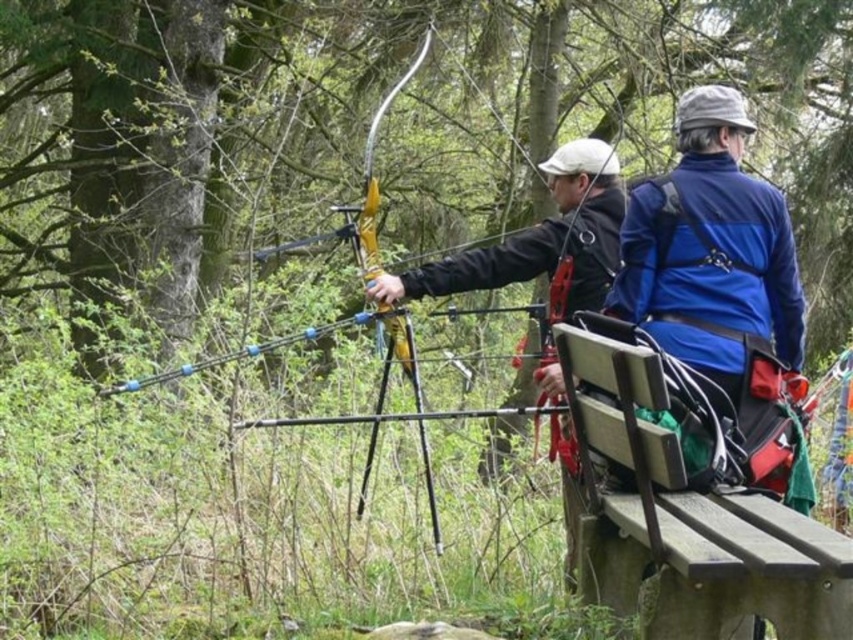
You are an archer standing at the edge of the woods, preparing to shoot an arrow. You notice a wooden park bench at center and a matte black jacket at center in your line of sight. Which object is closer to your position?

The wooden park bench at center is 1.52 meters away from matte black jacket at center. Since the question asks which is closer to your position, but the distance between them is provided, we need to clarify the exact positions. However, based on the given information, the bench and jacket are 1.52 meters apart. Without knowing your exact location relative to both, it is impossible to determine which is closer. The answer should state that the distance between them is known, but your position isnegative. 1.

You are an archer standing at point (593, 273) and want to shoot an arrow towards point (671, 627). Considering the archery scene described, will your arrow pass in front of or behind the person on the left who is drawing their bow?

The point (671, 627) is in front of point (593, 273), so the arrow will pass in front of the person on the left who is drawing their bow.